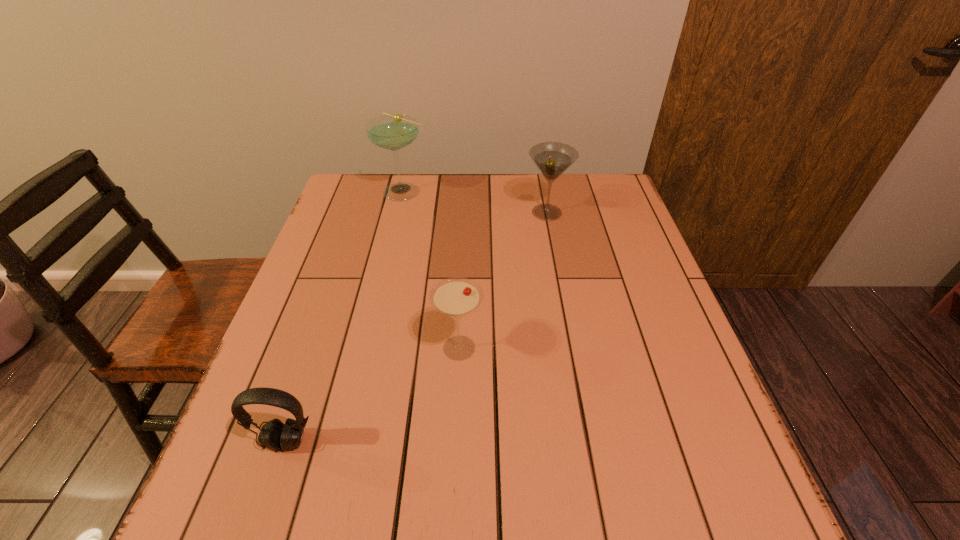
Identify the location of martini that can be found as the closest to the rightmost martini. The image size is (960, 540). (393, 132).

Locate an element on the screen. vacant point that satisfies the following two spatial constraints: 1. on the front side of the leftmost martini; 2. on the right side of the rightmost object is located at coordinates (400, 213).